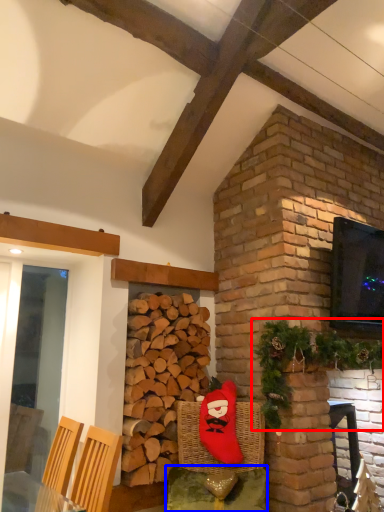
Question: Which of the following is the farthest to the observer, christmas decoration (highlighted by a red box) or table (highlighted by a blue box)?

Choices:
 (A) christmas decoration
 (B) table

Answer: (B)